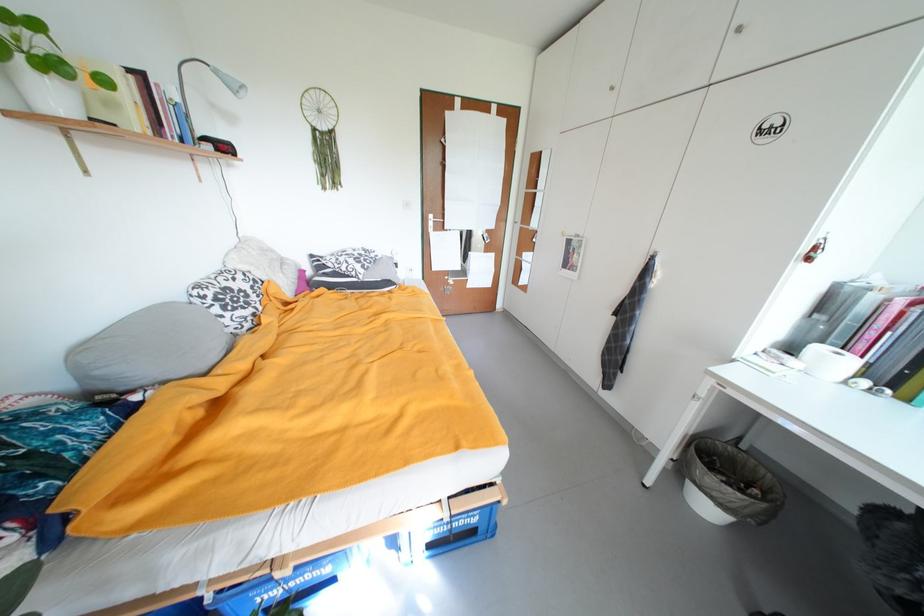
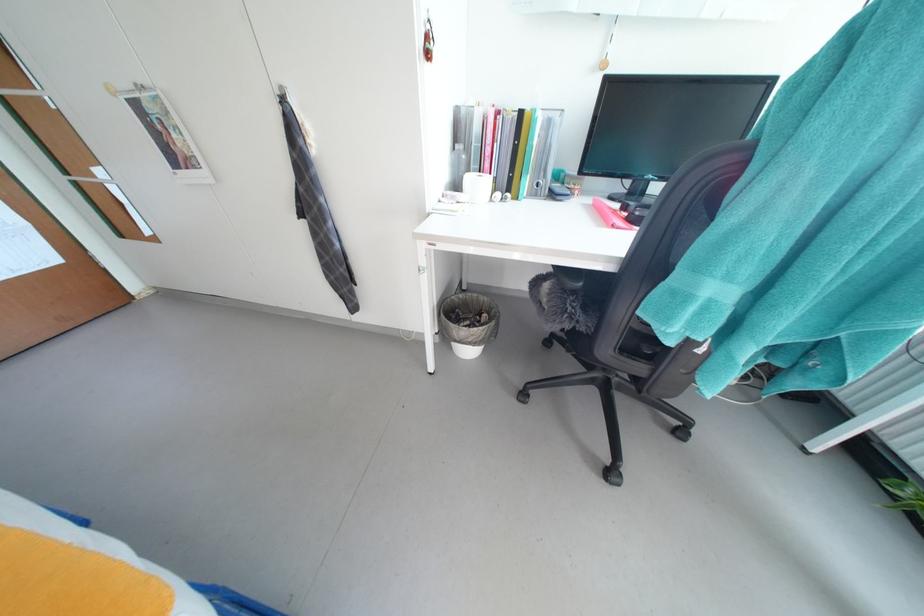
First-person continuous shooting, in which direction is the camera rotating?

The camera's rotation is toward right-down.